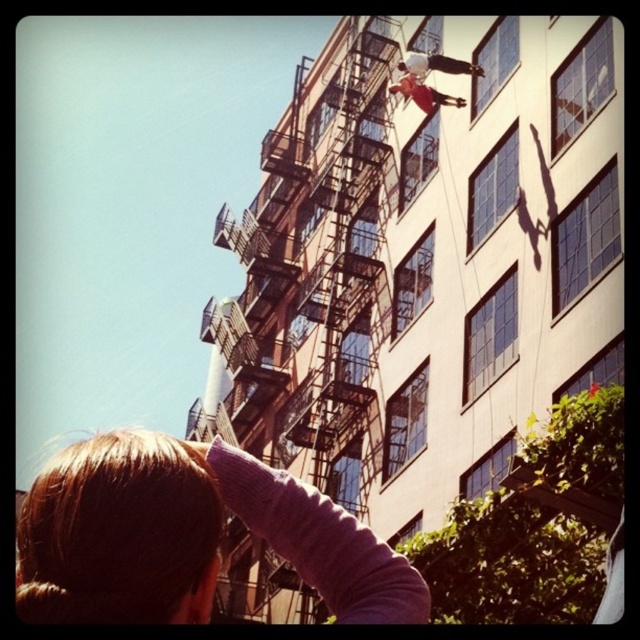
Question: Does metallic fire escape at center appear on the left side of blonde hair at lower left?

Choices:
 (A) no
 (B) yes

Answer: (B)

Question: Which object is closer to the camera taking this photo?

Choices:
 (A) metallic fire escape at center
 (B) blonde hair at lower left

Answer: (B)

Question: Can you confirm if metallic fire escape at center is smaller than blonde hair at lower left?

Choices:
 (A) no
 (B) yes

Answer: (A)

Question: Does metallic fire escape at center appear over blonde hair at lower left?

Choices:
 (A) no
 (B) yes

Answer: (B)